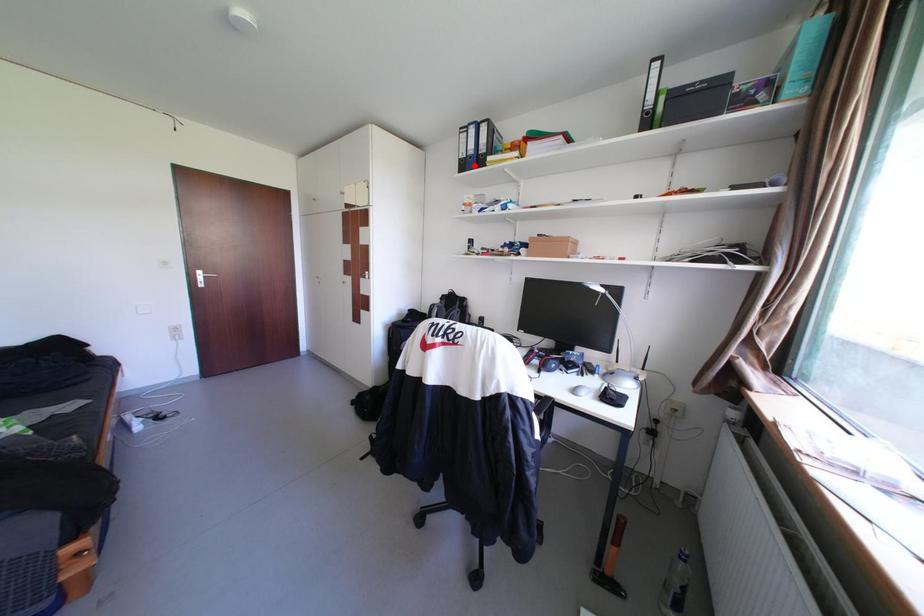
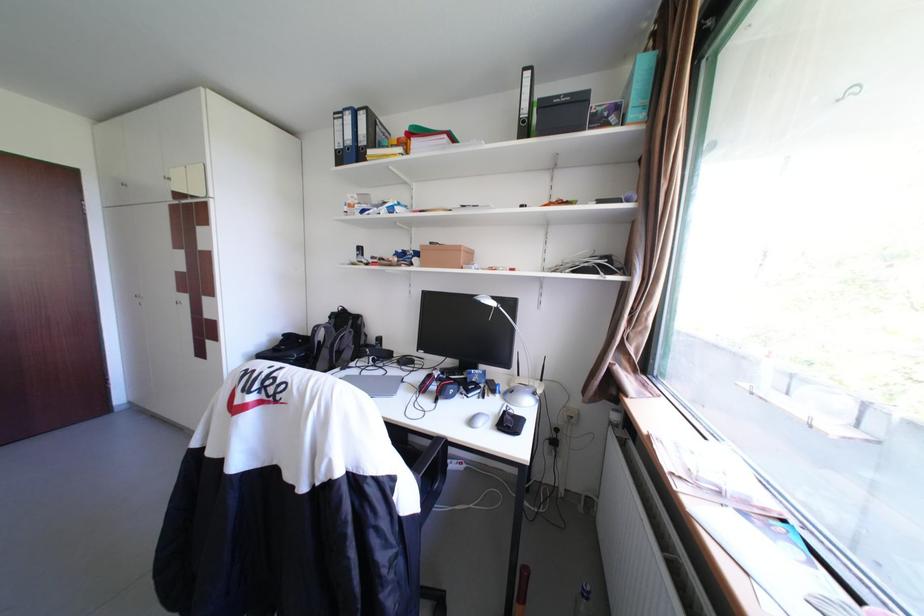
The point at the highlighted location is marked in the first image. Where is the corresponding point in the second image?

(351, 158)